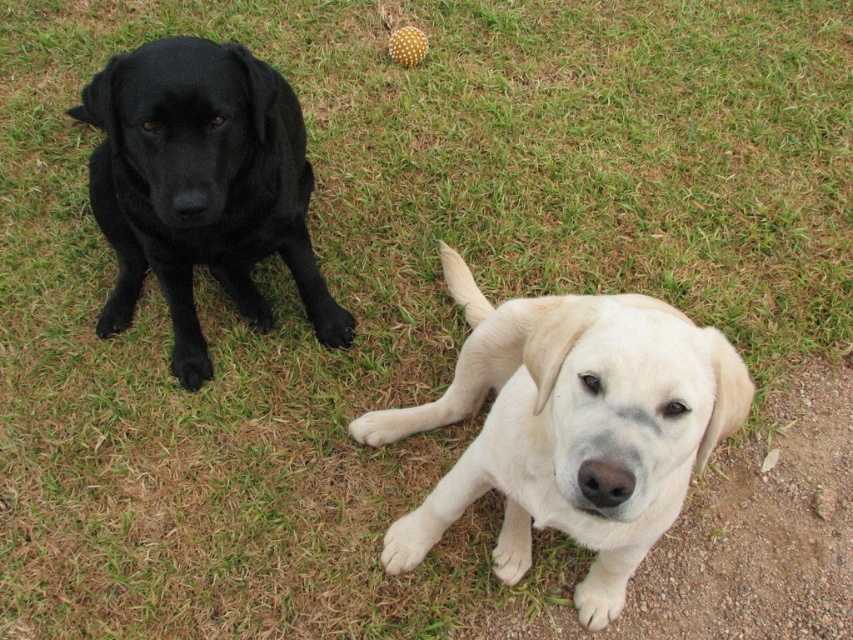
You are a photographer setting up for a pet photo shoot. You have two dogs in front of you, the light beige fur at center and the matte black dog at left. The client wants to know which dog is bigger. Based on the scene, what do you tell them?

The light beige fur at center is larger in size than the matte black dog at left, so the light beige fur at center is bigger.

You are a dog trainer who needs to place a treat between the light beige fur at center and the matte black dog at left. Can you fit the treat in the space between them if the treat is 2 inches wide?

The distance between the light beige fur at center and the matte black dog at left is 26.74 inches, which is more than enough to accommodate a 2 inch wide treat.

You are standing at the camera position and want to throw a ball to the light beige fur at center. According to the coordinates provided, where should you aim your throw in terms of direction and distance?

The light beige fur at center is located at coordinates point (572, 428), so you should aim your throw towards the center area of the image, slightly to the right and forward to reach the light beige fur at center.